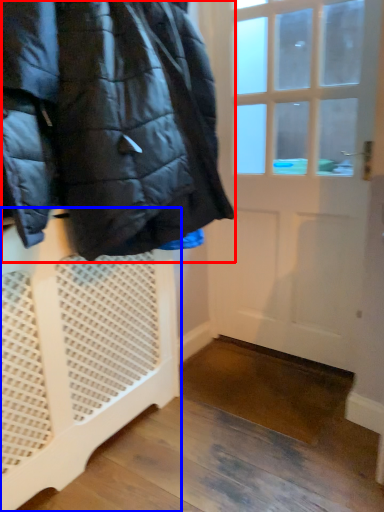
Question: Which point is closer to the camera, jacket (highlighted by a red box) or furniture (highlighted by a blue box)?

Choices:
 (A) jacket
 (B) furniture

Answer: (A)